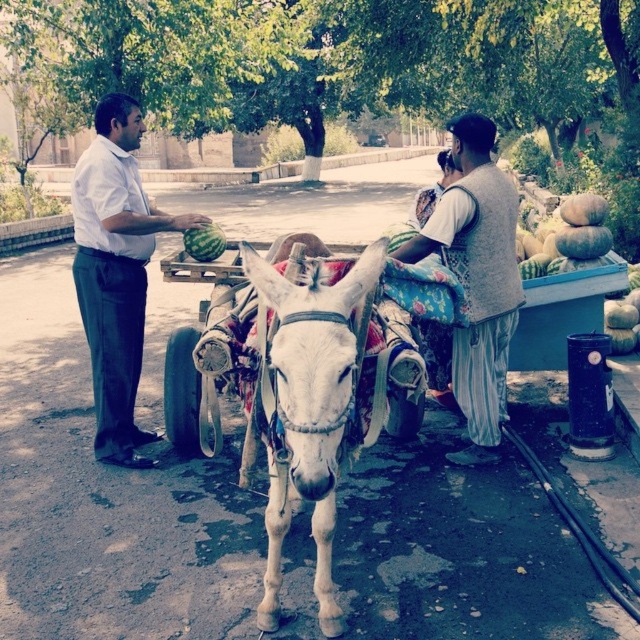
Is white shirt at left shorter than green matte watermelon at center?

No, white shirt at left is not shorter than green matte watermelon at center.

Can you confirm if white shirt at left is positioned to the right of green matte watermelon at center?

In fact, white shirt at left is to the left of green matte watermelon at center.

Does point (131, 362) come closer to viewer compared to point (186, 241)?

That is True.

Where is `white shirt at left`? The height and width of the screenshot is (640, 640). white shirt at left is located at coordinates (115, 272).

How far apart are white shirt at left and white leather wagon at center?

2.78 meters

Which is behind, point (172, 221) or point (541, 292)?

Positioned behind is point (541, 292).

Between point (115, 304) and point (563, 369), which one is positioned behind?

Positioned behind is point (563, 369).

Locate an element on the screen. The width and height of the screenshot is (640, 640). white shirt at left is located at coordinates (115, 272).

Is white leather wagon at center thinner than green textured pumpkins at right?

In fact, white leather wagon at center might be wider than green textured pumpkins at right.

Find the location of a particular element. The image size is (640, 640). white leather wagon at center is located at coordinates (561, 312).